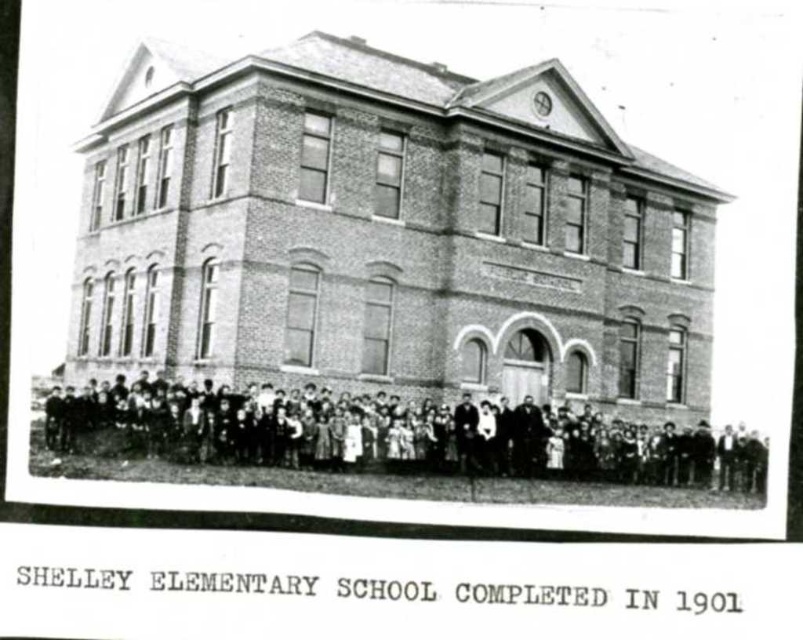
Question: Among these points, which one is farthest from the camera?

Choices:
 (A) (298, 456)
 (B) (471, 444)

Answer: (B)

Question: Which of the following is the closest to the observer?

Choices:
 (A) dark clothing group at center
 (B) smooth black suit at center

Answer: (A)

Question: Is dark clothing group at center smaller than smooth black suit at center?

Choices:
 (A) yes
 (B) no

Answer: (B)

Question: Can you confirm if dark clothing group at center is positioned to the left of smooth black suit at center?

Choices:
 (A) yes
 (B) no

Answer: (A)

Question: Which point appears farthest from the camera in this image?

Choices:
 (A) (469, 404)
 (B) (332, 403)

Answer: (A)

Question: Is dark clothing group at center behind smooth black suit at center?

Choices:
 (A) yes
 (B) no

Answer: (B)